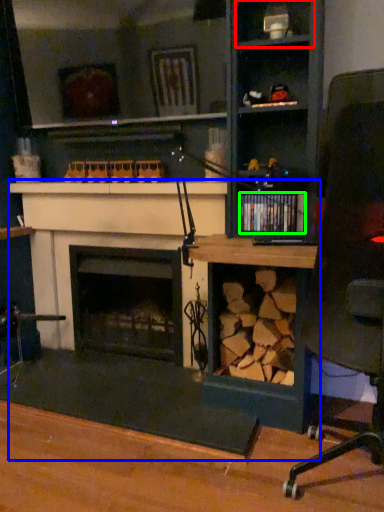
Question: Which is nearer to the shelf (highlighted by a red box)? computer desk (highlighted by a blue box) or book (highlighted by a green box).

Choices:
 (A) computer desk
 (B) book

Answer: (B)